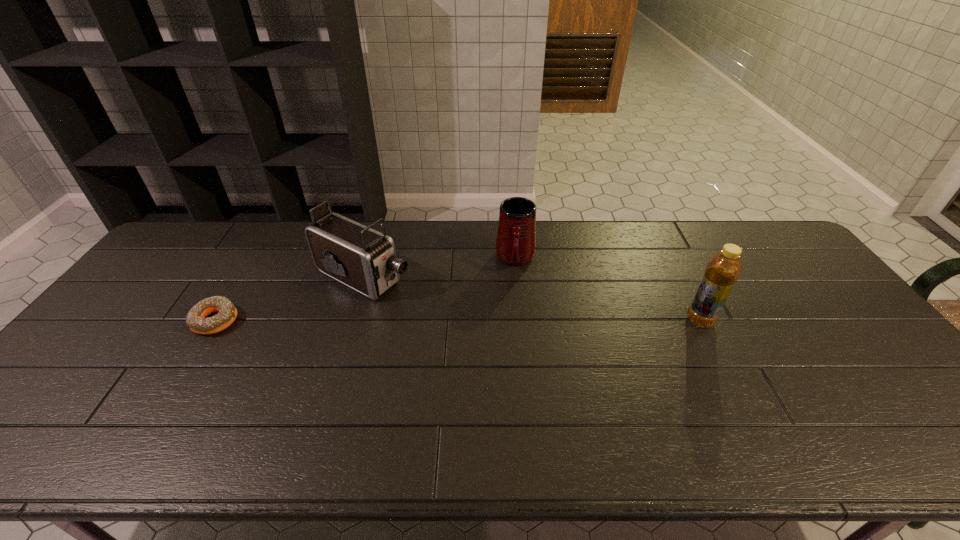
Locate an element on the screen. The width and height of the screenshot is (960, 540). vacant space situated 0.380m on the side of the third tallest object with the handle is located at coordinates (509, 377).

I want to click on free spot located 0.120m at the lens of the camcorder, so [x=434, y=307].

The width and height of the screenshot is (960, 540). In order to click on free point located at the lens of the camcorder in this screenshot , I will do `click(463, 321)`.

Find the location of `vacant space located 0.170m at the lens of the camcorder`. vacant space located 0.170m at the lens of the camcorder is located at coordinates click(448, 314).

Locate an element on the screen. This screenshot has height=540, width=960. mug that is at the far edge is located at coordinates (516, 237).

The height and width of the screenshot is (540, 960). I want to click on camcorder present at the far edge, so click(357, 256).

This screenshot has height=540, width=960. Find the location of `vacant position at the far edge of the desktop`. vacant position at the far edge of the desktop is located at coordinates (444, 231).

Locate an element on the screen. blank space at the near edge of the desktop is located at coordinates (558, 403).

This screenshot has width=960, height=540. I want to click on vacant space at the left edge of the desktop, so click(x=120, y=361).

In the image, there is a desktop. Where is `vacant area at the right edge`? The image size is (960, 540). vacant area at the right edge is located at coordinates (804, 278).